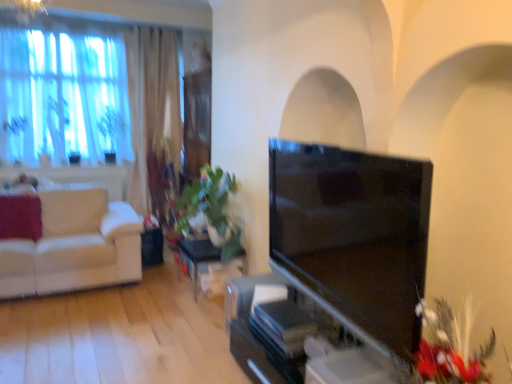
Question: Is green leafy plant at center at the right side of fluffy red flowers at lower right?

Choices:
 (A) yes
 (B) no

Answer: (B)

Question: Are green leafy plant at center and fluffy red flowers at lower right far apart?

Choices:
 (A) no
 (B) yes

Answer: (B)

Question: Is green leafy plant at center next to fluffy red flowers at lower right?

Choices:
 (A) no
 (B) yes

Answer: (A)

Question: Considering the relative sizes of green leafy plant at center and fluffy red flowers at lower right in the image provided, is green leafy plant at center thinner than fluffy red flowers at lower right?

Choices:
 (A) no
 (B) yes

Answer: (A)

Question: Considering the relative positions of green leafy plant at center and fluffy red flowers at lower right in the image provided, is green leafy plant at center behind fluffy red flowers at lower right?

Choices:
 (A) yes
 (B) no

Answer: (A)

Question: Is the position of green leafy plant at center less distant than that of fluffy red flowers at lower right?

Choices:
 (A) no
 (B) yes

Answer: (A)

Question: Is green leafy plant at center located within matte black tv at center?

Choices:
 (A) yes
 (B) no

Answer: (B)

Question: Is matte black tv at center smaller than green leafy plant at center?

Choices:
 (A) yes
 (B) no

Answer: (A)

Question: From the image's perspective, is matte black tv at center located above green leafy plant at center?

Choices:
 (A) no
 (B) yes

Answer: (A)

Question: Is matte black tv at center next to green leafy plant at center?

Choices:
 (A) no
 (B) yes

Answer: (A)

Question: From the image's perspective, is matte black tv at center under green leafy plant at center?

Choices:
 (A) no
 (B) yes

Answer: (B)

Question: Is matte black tv at center positioned behind green leafy plant at center?

Choices:
 (A) no
 (B) yes

Answer: (A)

Question: Can you confirm if matte black tv at center is smaller than white fabric couch at left?

Choices:
 (A) yes
 (B) no

Answer: (A)